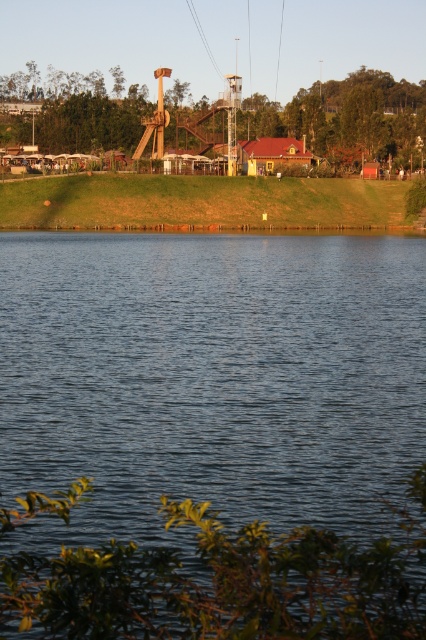
Who is more forward, (164, 205) or (201, 38)?

Point (164, 205)

Can you confirm if rustic wooden slide at upper center is smaller than black wire at upper center?

No, rustic wooden slide at upper center is not smaller than black wire at upper center.

In the scene shown: Who is more forward, (423, 200) or (195, 20)?

Point (423, 200) is more forward.

The height and width of the screenshot is (640, 426). I want to click on rustic wooden slide at upper center, so click(203, 202).

Is blue water at center to the left of black wire at upper center from the viewer's perspective?

Incorrect, blue water at center is not on the left side of black wire at upper center.

Describe the element at coordinates (213, 433) in the screenshot. I see `blue water at center` at that location.

What do you see at coordinates (213, 433) in the screenshot? I see `blue water at center` at bounding box center [213, 433].

Find the location of a particular element. blue water at center is located at coordinates (213, 433).

Can you confirm if blue water at center is smaller than rustic wooden slide at upper center?

Yes.

Image resolution: width=426 pixels, height=640 pixels. Describe the element at coordinates (213, 433) in the screenshot. I see `blue water at center` at that location.

At what (x,y) coordinates should I click in order to perform the action: click on blue water at center. Please return your answer as a coordinate pair (x, y). The height and width of the screenshot is (640, 426). Looking at the image, I should click on (213, 433).